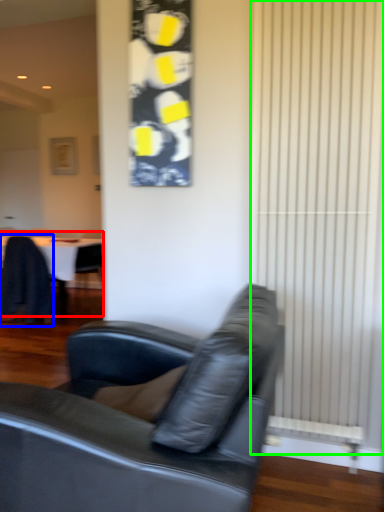
Question: Which object is the closest to the table (highlighted by a red box)? Choose among these: chair (highlighted by a blue box) or curtain (highlighted by a green box).

Choices:
 (A) chair
 (B) curtain

Answer: (A)